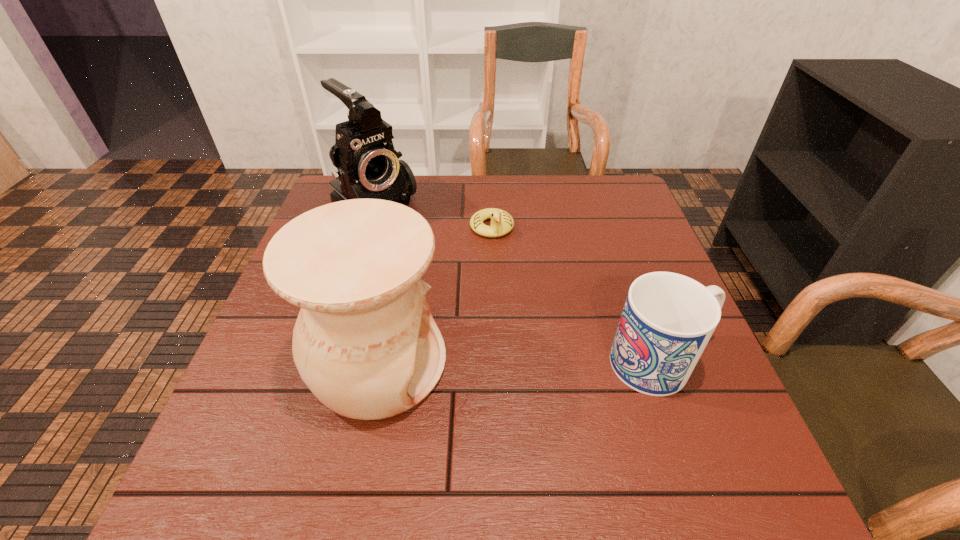
Locate an element on the screen. Image resolution: width=960 pixels, height=540 pixels. vacant region located 0.140m on the lens mount of the camcorder is located at coordinates (425, 266).

Where is `vacant space located 0.050m on the face of the duckling`? vacant space located 0.050m on the face of the duckling is located at coordinates (500, 254).

Where is `free spot located 0.150m on the face of the duckling`? The width and height of the screenshot is (960, 540). free spot located 0.150m on the face of the duckling is located at coordinates (509, 281).

Locate an element on the screen. This screenshot has width=960, height=540. free space located 0.120m on the face of the duckling is located at coordinates pos(506,273).

The image size is (960, 540). Find the location of `camcorder that is at the far edge`. camcorder that is at the far edge is located at coordinates (368, 167).

Where is `duckling that is at the far edge`? duckling that is at the far edge is located at coordinates (502, 222).

Where is `object present at the near edge`? Image resolution: width=960 pixels, height=540 pixels. object present at the near edge is located at coordinates (365, 343).

This screenshot has width=960, height=540. Identify the location of pottery located at the left edge. (365, 343).

Where is `camcorder that is at the left edge`? Image resolution: width=960 pixels, height=540 pixels. camcorder that is at the left edge is located at coordinates (368, 167).

Locate an element on the screen. object that is at the right edge is located at coordinates [668, 318].